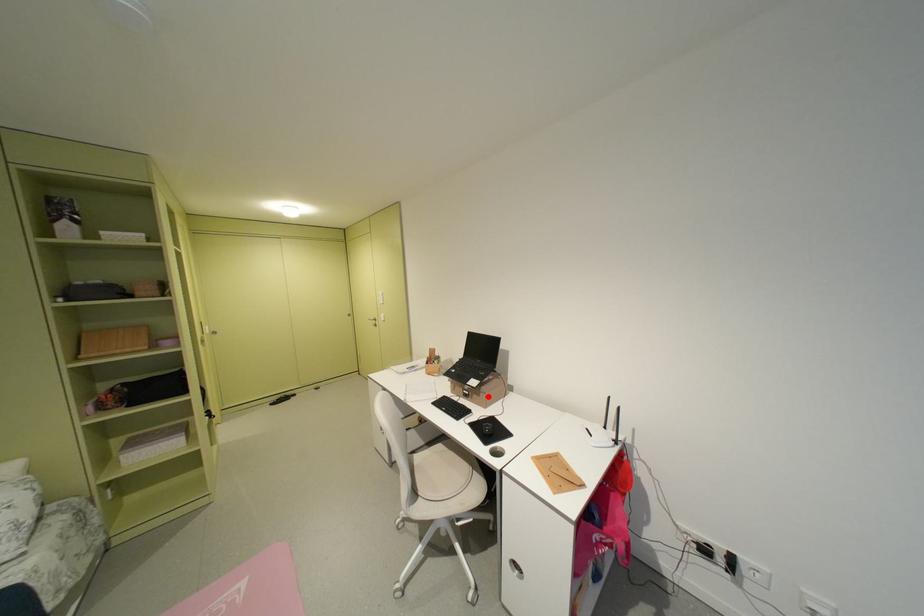
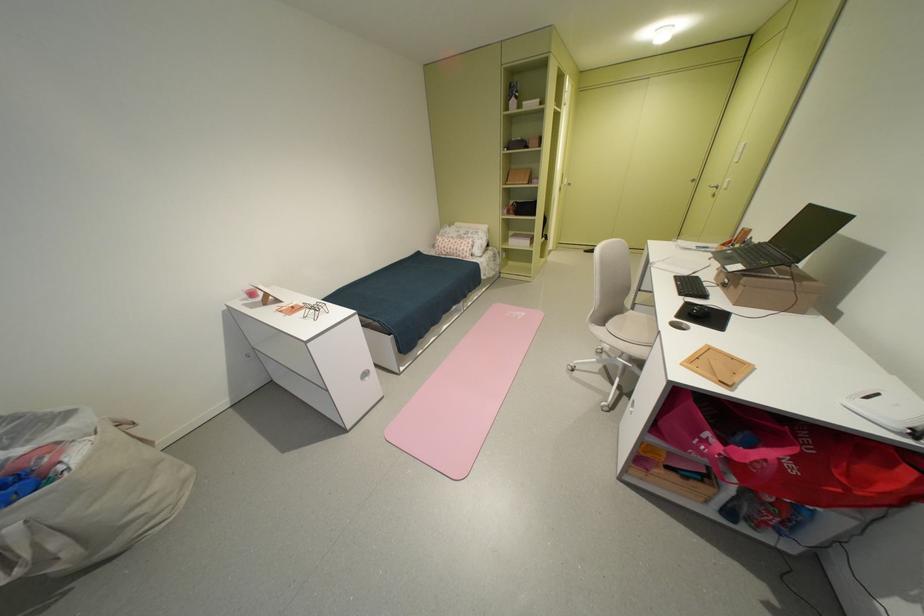
The point at the highlighted location is marked in the first image. Where is the corresponding point in the second image?

(746, 288)